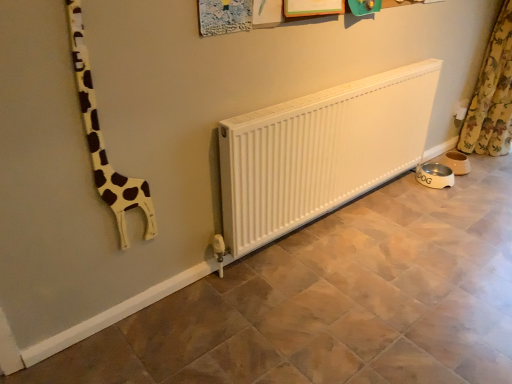
Measure the distance between white matte giraffe at left and camera.

white matte giraffe at left is 3.62 feet from camera.

What is the approximate width of white matte giraffe at left?

The width of white matte giraffe at left is 2.62 centimeters.

The image size is (512, 384). Describe the element at coordinates (102, 141) in the screenshot. I see `white matte giraffe at left` at that location.

Where is `white matte giraffe at left`? white matte giraffe at left is located at coordinates (102, 141).

Measure the distance between floral fabric curtain at right and camera.

A distance of 2.55 meters exists between floral fabric curtain at right and camera.

Identify the location of floral fabric curtain at right. This screenshot has height=384, width=512. (492, 95).

Describe the element at coordinates (492, 95) in the screenshot. I see `floral fabric curtain at right` at that location.

The height and width of the screenshot is (384, 512). I want to click on white matte giraffe at left, so click(x=102, y=141).

Which is more to the right, white matte giraffe at left or floral fabric curtain at right?

From the viewer's perspective, floral fabric curtain at right appears more on the right side.

Which object is closer to the camera, white matte giraffe at left or floral fabric curtain at right?

white matte giraffe at left is in front.

Does point (105, 199) appear closer or farther from the camera than point (503, 81)?

Point (105, 199) is closer to the camera than point (503, 81).

From the image's perspective, does white matte giraffe at left appear higher than floral fabric curtain at right?

Actually, white matte giraffe at left appears below floral fabric curtain at right in the image.

Looking at this image, from a real-world perspective, is white matte giraffe at left beneath floral fabric curtain at right?

No, from a real-world perspective, white matte giraffe at left is not under floral fabric curtain at right.

Considering the sizes of white matte giraffe at left and floral fabric curtain at right in the image, is white matte giraffe at left wider or thinner than floral fabric curtain at right?

Considering their sizes, white matte giraffe at left looks slimmer than floral fabric curtain at right.

Considering the relative sizes of white matte giraffe at left and floral fabric curtain at right in the image provided, is white matte giraffe at left shorter than floral fabric curtain at right?

Yes.

Who is bigger, white matte giraffe at left or floral fabric curtain at right?

Bigger between the two is floral fabric curtain at right.

Is white matte giraffe at left inside the boundaries of floral fabric curtain at right, or outside?

white matte giraffe at left is not inside floral fabric curtain at right, it's outside.

Is white matte giraffe at left placed right next to floral fabric curtain at right?

No, white matte giraffe at left is not with floral fabric curtain at right.

Does white matte giraffe at left turn towards floral fabric curtain at right?

No, white matte giraffe at left is not aimed at floral fabric curtain at right.

Locate an element on the screen. curtain behind the white matte giraffe at left is located at coordinates (492, 95).

Is floral fabric curtain at right at the left side of white matte giraffe at left?

Incorrect, floral fabric curtain at right is not on the left side of white matte giraffe at left.

Which is in front, floral fabric curtain at right or white matte giraffe at left?

white matte giraffe at left is in front.

Considering the points (497, 105) and (98, 180), which point is in front, point (497, 105) or point (98, 180)?

The point (98, 180) is closer to the camera.

From the image's perspective, is floral fabric curtain at right on top of white matte giraffe at left?

Yes.

From a real-world perspective, between floral fabric curtain at right and white matte giraffe at left, who is vertically lower?

floral fabric curtain at right is physically lower.

Considering the relative sizes of floral fabric curtain at right and white matte giraffe at left in the image provided, is floral fabric curtain at right thinner than white matte giraffe at left?

In fact, floral fabric curtain at right might be wider than white matte giraffe at left.

Can you confirm if floral fabric curtain at right is shorter than white matte giraffe at left?

In fact, floral fabric curtain at right may be taller than white matte giraffe at left.

Considering the relative sizes of floral fabric curtain at right and white matte giraffe at left in the image provided, is floral fabric curtain at right bigger than white matte giraffe at left?

Indeed, floral fabric curtain at right has a larger size compared to white matte giraffe at left.

Do you think floral fabric curtain at right is within white matte giraffe at left, or outside of it?

floral fabric curtain at right cannot be found inside white matte giraffe at left.

Is floral fabric curtain at right next to white matte giraffe at left and touching it?

No, floral fabric curtain at right is not in contact with white matte giraffe at left.

Is floral fabric curtain at right oriented towards white matte giraffe at left?

Yes, floral fabric curtain at right is turned towards white matte giraffe at left.

What's the angular difference between floral fabric curtain at right and white matte giraffe at left's facing directions?

The angular difference between floral fabric curtain at right and white matte giraffe at left is 89.8 degrees.

How distant is floral fabric curtain at right from white matte giraffe at left?

floral fabric curtain at right and white matte giraffe at left are 2.35 meters apart.

The height and width of the screenshot is (384, 512). Find the location of `curtain below the white matte giraffe at left (from a real-world perspective)`. curtain below the white matte giraffe at left (from a real-world perspective) is located at coordinates (492, 95).

I want to click on curtain that appears on the right of white matte giraffe at left, so click(x=492, y=95).

Where is `giraffe in front of the floral fabric curtain at right`? giraffe in front of the floral fabric curtain at right is located at coordinates (102, 141).